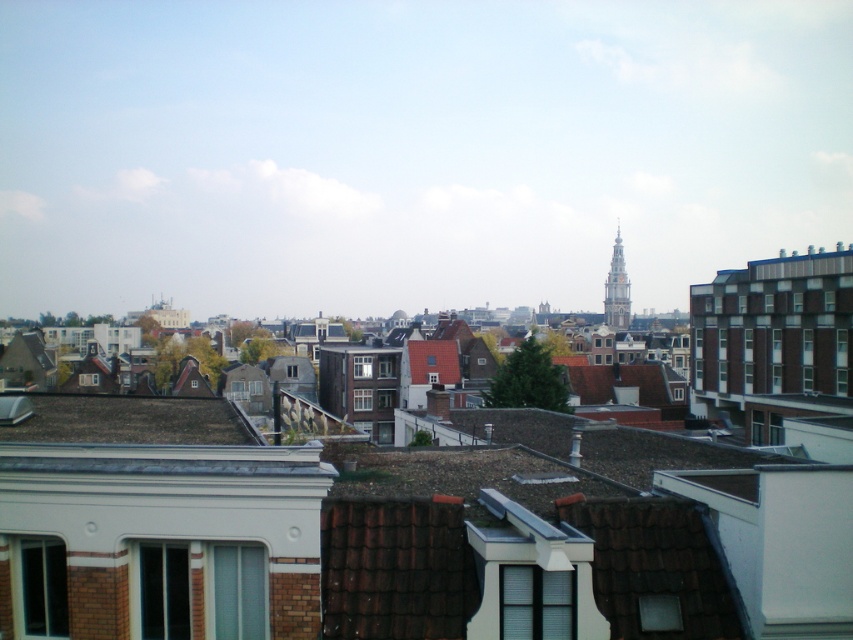
Question: Where is brown shingles at lower left located in relation to golden stone tower at upper right in the image?

Choices:
 (A) above
 (B) below

Answer: (B)

Question: Is brown shingles at lower left behind golden stone tower at upper right?

Choices:
 (A) yes
 (B) no

Answer: (B)

Question: Which point appears farthest from the camera in this image?

Choices:
 (A) (161, 422)
 (B) (614, 269)

Answer: (B)

Question: Is brown shingles at lower left to the right of golden stone tower at upper right from the viewer's perspective?

Choices:
 (A) yes
 (B) no

Answer: (B)

Question: Which of the following is the closest to the observer?

Choices:
 (A) brown shingles at lower left
 (B) golden stone tower at upper right

Answer: (A)